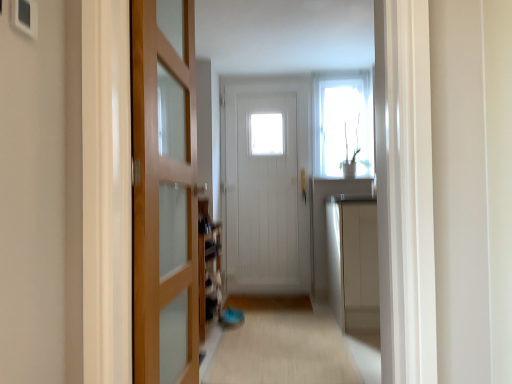
Question: Can you confirm if white glossy window at upper center is shorter than white wooden door at center, the 2th door when ordered from left to right?

Choices:
 (A) no
 (B) yes

Answer: (B)

Question: Is white glossy window at upper center oriented towards white wooden door at center, acting as the first door starting from the back?

Choices:
 (A) no
 (B) yes

Answer: (A)

Question: From the image's perspective, would you say white glossy window at upper center is positioned over white wooden door at center, the first door from the right?

Choices:
 (A) no
 (B) yes

Answer: (B)

Question: Does white glossy window at upper center touch white wooden door at center, acting as the first door starting from the back?

Choices:
 (A) yes
 (B) no

Answer: (B)

Question: Is white glossy window at upper center at the right side of white wooden door at center, the 2th door when ordered from left to right?

Choices:
 (A) no
 (B) yes

Answer: (B)

Question: Based on their positions, is white glossy window at upper center located to the left or right of white wooden door at center, the 2th door when ordered from left to right?

Choices:
 (A) right
 (B) left

Answer: (A)

Question: Based on their sizes in the image, would you say white glossy window at upper center is bigger or smaller than white wooden door at center, which is the 2th door in front-to-back order?

Choices:
 (A) big
 (B) small

Answer: (B)

Question: Is white glossy window at upper center taller or shorter than white wooden door at center, which is the 2th door in front-to-back order?

Choices:
 (A) short
 (B) tall

Answer: (A)

Question: Is white glossy window at upper center wider or thinner than white wooden door at center, acting as the first door starting from the back?

Choices:
 (A) thin
 (B) wide

Answer: (A)

Question: In the image, is white wooden door at center, which is the 2th door in front-to-back order, positioned in front of or behind beige carpet at center?

Choices:
 (A) behind
 (B) front

Answer: (A)

Question: In terms of size, does white wooden door at center, the 2th door when ordered from left to right, appear bigger or smaller than beige carpet at center?

Choices:
 (A) big
 (B) small

Answer: (A)

Question: In terms of height, does white wooden door at center, acting as the first door starting from the back, look taller or shorter compared to beige carpet at center?

Choices:
 (A) short
 (B) tall

Answer: (B)

Question: Considering the positions of white wooden door at center, acting as the first door starting from the back, and beige carpet at center in the image, is white wooden door at center, acting as the first door starting from the back, wider or thinner than beige carpet at center?

Choices:
 (A) thin
 (B) wide

Answer: (A)

Question: Would you say wooden door at left, the 1th door in the front-to-back sequence, is to the left or to the right of beige carpet at center in the picture?

Choices:
 (A) right
 (B) left

Answer: (B)

Question: Is wooden door at left, the first door in the left-to-right sequence, in front of or behind beige carpet at center in the image?

Choices:
 (A) behind
 (B) front

Answer: (B)